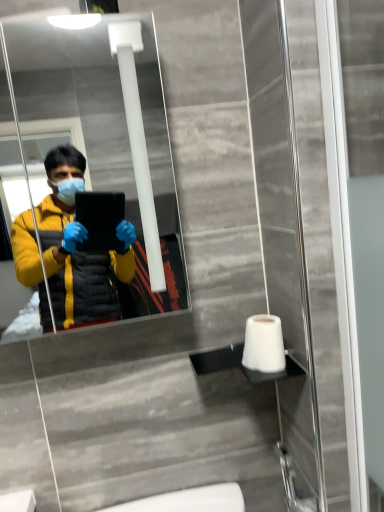
Question: Considering their positions, is transparent glass screen door at right located in front of or behind white matte toilet paper at lower right?

Choices:
 (A) behind
 (B) front

Answer: (B)

Question: In terms of width, does transparent glass screen door at right look wider or thinner when compared to white matte toilet paper at lower right?

Choices:
 (A) wide
 (B) thin

Answer: (B)

Question: Which object is the farthest from the matte black mirror at upper center?

Choices:
 (A) white matte toilet paper at lower right
 (B) transparent glass screen door at right

Answer: (B)

Question: Which object is the farthest from the white matte toilet paper at lower right?

Choices:
 (A) matte black mirror at upper center
 (B) transparent glass screen door at right

Answer: (A)